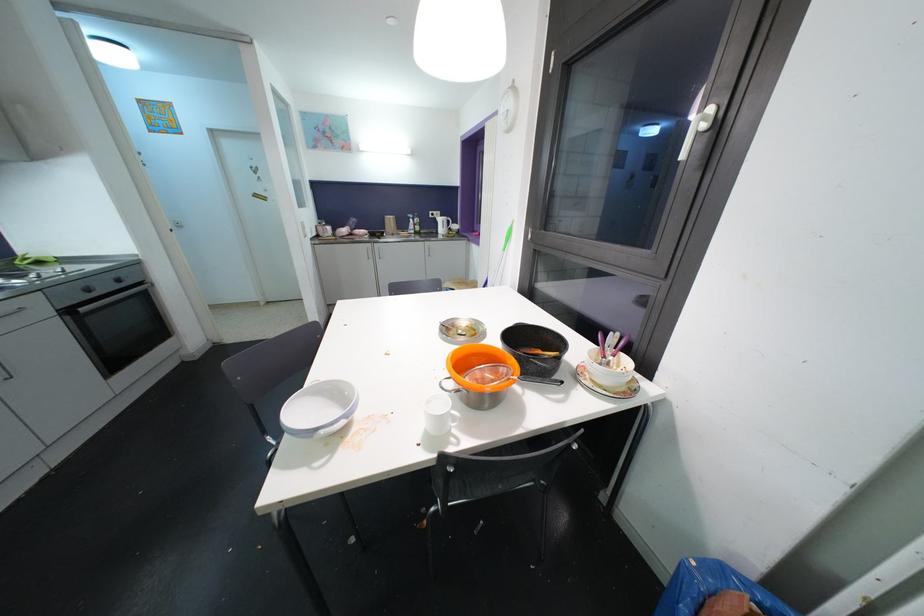
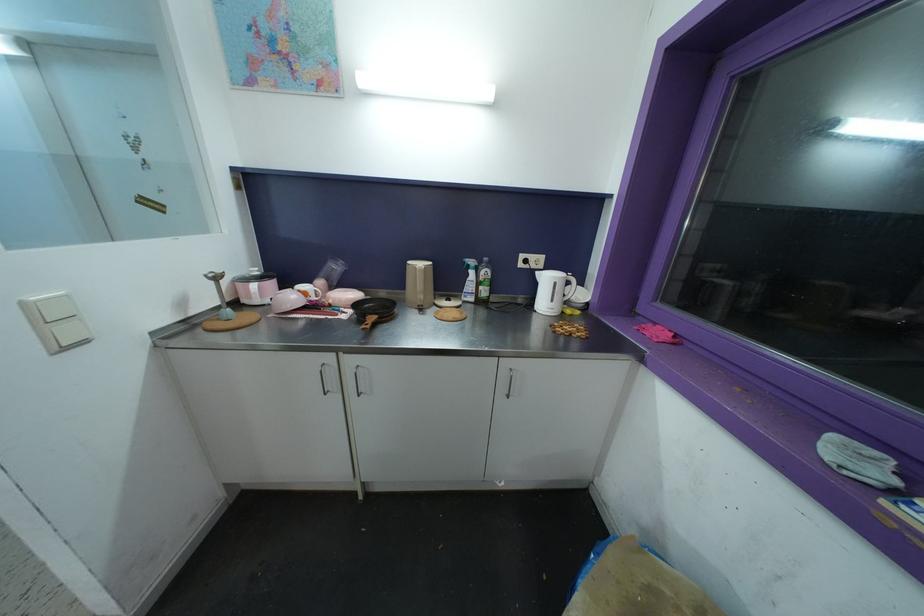
Question: In a continuous first-person perspective shot, in which direction is the camera moving?

Choices:
 (A) Left
 (B) Right
 (C) Forward
 (D) Backward

Answer: (C)